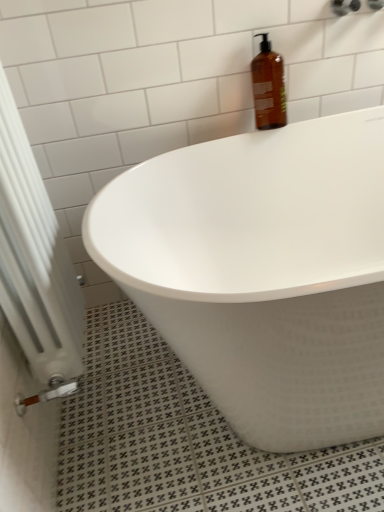
Question: Can you confirm if brown glass bottle at upper center is bigger than white glossy bathtub at upper center?

Choices:
 (A) yes
 (B) no

Answer: (B)

Question: Is brown glass bottle at upper center facing towards white glossy bathtub at upper center?

Choices:
 (A) yes
 (B) no

Answer: (B)

Question: From a real-world perspective, is brown glass bottle at upper center over white glossy bathtub at upper center?

Choices:
 (A) yes
 (B) no

Answer: (A)

Question: Can you confirm if brown glass bottle at upper center is taller than white glossy bathtub at upper center?

Choices:
 (A) no
 (B) yes

Answer: (A)

Question: Is white glossy bathtub at upper center at the back of brown glass bottle at upper center?

Choices:
 (A) no
 (B) yes

Answer: (A)

Question: Would you say white glossy bathtub at upper center is inside or outside brown glass bottle at upper center?

Choices:
 (A) outside
 (B) inside

Answer: (A)

Question: Considering the positions of point (294, 196) and point (273, 55), is point (294, 196) closer or farther from the camera than point (273, 55)?

Choices:
 (A) farther
 (B) closer

Answer: (A)

Question: Considering the positions of white glossy bathtub at upper center and brown glass bottle at upper center in the image, is white glossy bathtub at upper center bigger or smaller than brown glass bottle at upper center?

Choices:
 (A) small
 (B) big

Answer: (B)

Question: Considering the positions of white glossy bathtub at upper center and brown glass bottle at upper center in the image, is white glossy bathtub at upper center taller or shorter than brown glass bottle at upper center?

Choices:
 (A) short
 (B) tall

Answer: (B)

Question: Do you think white glossy bathtub at upper center is within white metallic radiator at lower left, or outside of it?

Choices:
 (A) outside
 (B) inside

Answer: (A)

Question: In terms of height, does white glossy bathtub at upper center look taller or shorter compared to white metallic radiator at lower left?

Choices:
 (A) tall
 (B) short

Answer: (B)

Question: Based on their sizes in the image, would you say white glossy bathtub at upper center is bigger or smaller than white metallic radiator at lower left?

Choices:
 (A) big
 (B) small

Answer: (A)

Question: Does point (321, 194) appear closer or farther from the camera than point (23, 320)?

Choices:
 (A) closer
 (B) farther

Answer: (B)

Question: Considering the positions of brown glass bottle at upper center and white metallic radiator at lower left in the image, is brown glass bottle at upper center bigger or smaller than white metallic radiator at lower left?

Choices:
 (A) small
 (B) big

Answer: (A)

Question: Based on their positions, is brown glass bottle at upper center located to the left or right of white metallic radiator at lower left?

Choices:
 (A) right
 (B) left

Answer: (A)